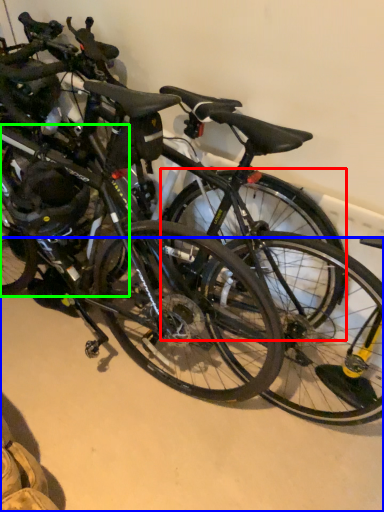
Question: Estimate the real-world distances between objects in this image. Which object is farther from bicycle wheel (highlighted by a red box), concrete (highlighted by a blue box) or bicycle wheel (highlighted by a green box)?

Choices:
 (A) concrete
 (B) bicycle wheel

Answer: (A)